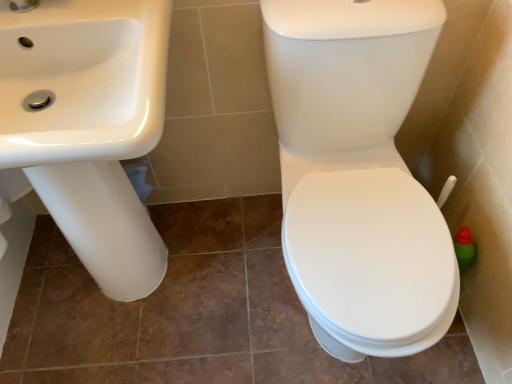
At what (x,y) coordinates should I click in order to perform the action: click on free space to the left of white glossy toilet at right. Please return your answer as a coordinate pair (x, y). Image resolution: width=512 pixels, height=384 pixels. Looking at the image, I should click on (222, 303).